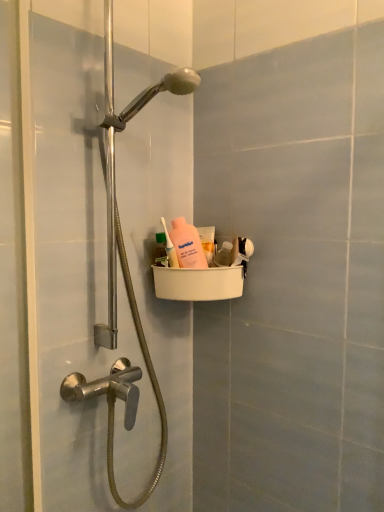
Question: Which direction should I rotate to look at pink matte bottle at center, which is the first mouthwash in right-to-left order?

Choices:
 (A) left
 (B) right

Answer: (B)

Question: Should I look upward or downward to see pink matte bottle at upper center?

Choices:
 (A) up
 (B) down

Answer: (A)

Question: Can you see pink matte bottle at center, which is the first mouthwash in right-to-left order, touching white plastic basket at upper center?

Choices:
 (A) yes
 (B) no

Answer: (B)

Question: Is pink matte bottle at center, the second mouthwash from the left, thinner than white plastic basket at upper center?

Choices:
 (A) no
 (B) yes

Answer: (B)

Question: Would you say pink matte bottle at center, acting as the second mouthwash starting from the front, is outside white plastic basket at upper center?

Choices:
 (A) no
 (B) yes

Answer: (B)

Question: Is pink matte bottle at center, the second mouthwash from the left, smaller than white plastic basket at upper center?

Choices:
 (A) no
 (B) yes

Answer: (B)

Question: Is pink matte bottle at center, the first mouthwash positioned from the back, further to camera compared to white plastic basket at upper center?

Choices:
 (A) yes
 (B) no

Answer: (A)

Question: From a real-world perspective, does pink matte bottle at center, acting as the second mouthwash starting from the front, sit lower than white plastic basket at upper center?

Choices:
 (A) no
 (B) yes

Answer: (A)

Question: Does pink matte bottle at upper center have a smaller size compared to green plastic bottle at upper center, the 2th mouthwash in the right-to-left sequence?

Choices:
 (A) no
 (B) yes

Answer: (A)

Question: From the image's perspective, is pink matte bottle at upper center above green plastic bottle at upper center, which is the 2th mouthwash from back to front?

Choices:
 (A) yes
 (B) no

Answer: (A)

Question: Is pink matte bottle at upper center outside green plastic bottle at upper center, which is the 1th mouthwash in front-to-back order?

Choices:
 (A) yes
 (B) no

Answer: (A)

Question: Can you confirm if pink matte bottle at upper center is positioned to the left of green plastic bottle at upper center, which is the 2th mouthwash from back to front?

Choices:
 (A) yes
 (B) no

Answer: (B)

Question: Is pink matte bottle at upper center thinner than green plastic bottle at upper center, which is the 2th mouthwash from back to front?

Choices:
 (A) yes
 (B) no

Answer: (B)

Question: Could you tell me if pink matte bottle at upper center is turned towards green plastic bottle at upper center, the 2th mouthwash in the right-to-left sequence?

Choices:
 (A) no
 (B) yes

Answer: (A)

Question: Can you confirm if pink matte bottle at upper center is wider than white plastic basket at upper center?

Choices:
 (A) no
 (B) yes

Answer: (A)